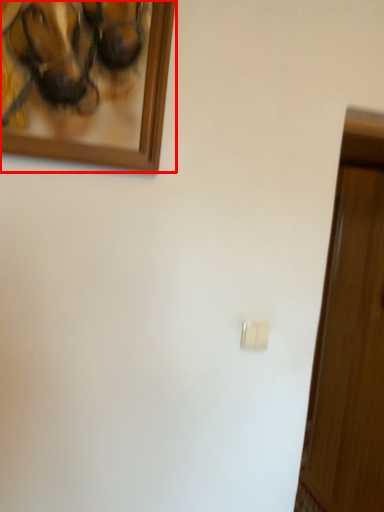
Question: From the image's perspective, considering the relative positions of picture frame (annotated by the red box) and light switch in the image provided, where is picture frame (annotated by the red box) located with respect to the staircase?

Choices:
 (A) above
 (B) below

Answer: (A)